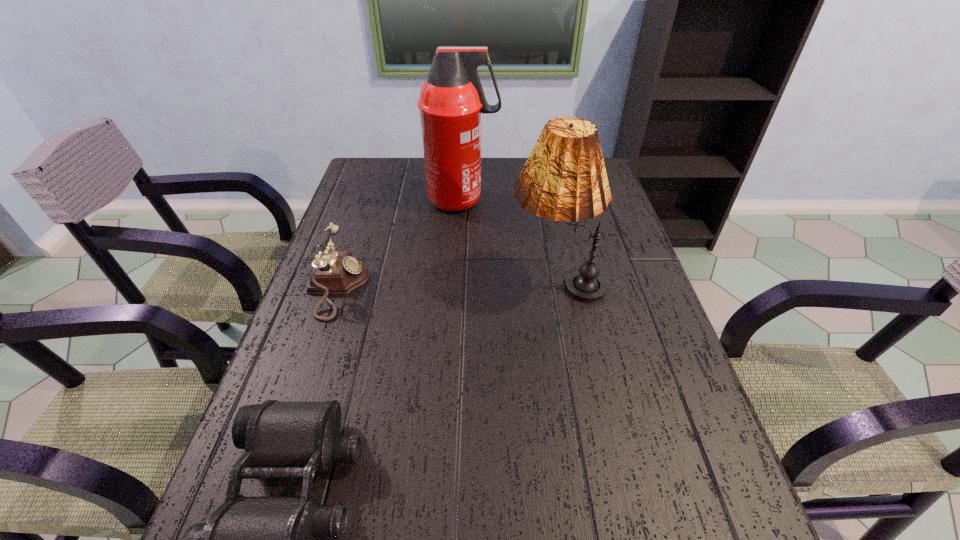
This screenshot has width=960, height=540. Find the location of `fire extinguisher`. fire extinguisher is located at coordinates (451, 101).

Find the location of a particular element. This screenshot has height=540, width=960. the third object from left to right is located at coordinates (451, 101).

At what (x,y) coordinates should I click in order to perform the action: click on lampshade. Please return your answer as a coordinate pair (x, y). The image size is (960, 540). Looking at the image, I should click on [564, 178].

This screenshot has height=540, width=960. Identify the location of the second shortest object. (335, 272).

Identify the location of vacant region located 0.200m on the trigger side of the second object from right to left. This screenshot has width=960, height=540. (561, 200).

Find the location of a particular element. The width and height of the screenshot is (960, 540). free space located 0.130m on the front-facing side of the lampshade is located at coordinates (458, 281).

At what (x,y) coordinates should I click in order to perform the action: click on free spot located 0.220m on the front-facing side of the lampshade. Please return your answer as a coordinate pair (x, y). Image resolution: width=960 pixels, height=540 pixels. Looking at the image, I should click on (422, 281).

The image size is (960, 540). Find the location of `vacant space located 0.100m on the front-facing side of the lampshade`. vacant space located 0.100m on the front-facing side of the lampshade is located at coordinates (469, 281).

Where is `vacant space located on the dial of the telephone`? This screenshot has width=960, height=540. vacant space located on the dial of the telephone is located at coordinates (406, 287).

The height and width of the screenshot is (540, 960). I want to click on object that is positioned at the far edge, so click(451, 101).